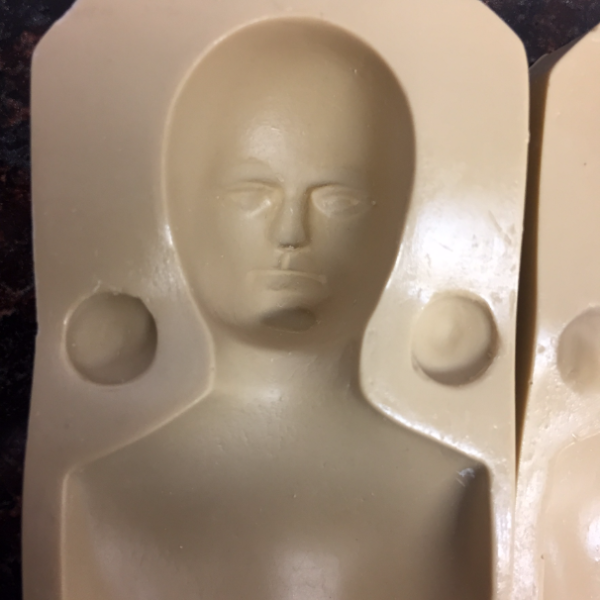
I want to click on counter, so [x=546, y=30].